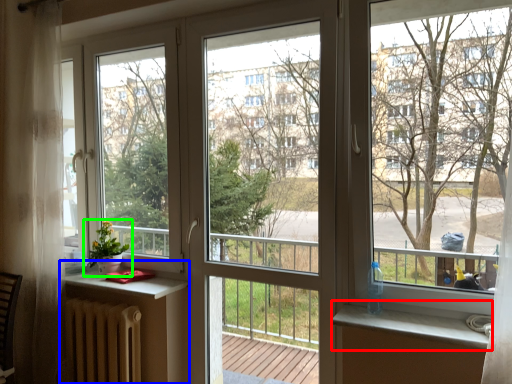
Question: Which object is the farthest from window sill (highlighted by a red box)? Choose among these: table (highlighted by a blue box) or houseplant (highlighted by a green box).

Choices:
 (A) table
 (B) houseplant

Answer: (B)